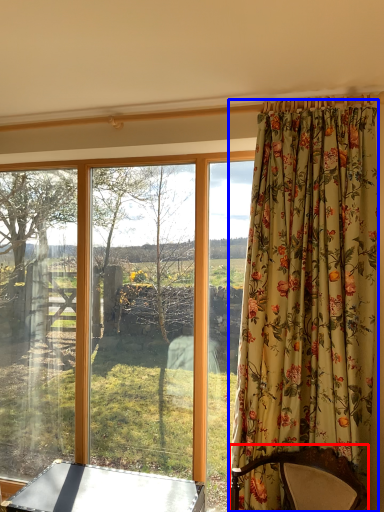
Question: Which of the following is the farthest to the observer, furniture (highlighted by a red box) or curtain (highlighted by a blue box)?

Choices:
 (A) furniture
 (B) curtain

Answer: (B)